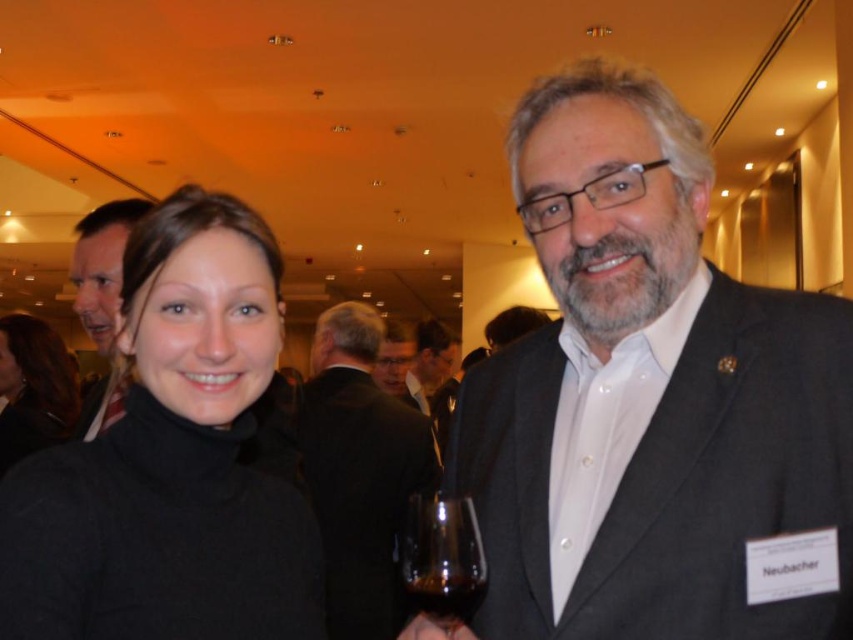
You are standing in the center of the hall and want to approach the dark gray suit at center. According to the coordinates, where should you walk to find it?

The dark gray suit at center is located at coordinates point (428,362), so you should walk towards the center area slightly to the right and forward to find it.

Looking at this image, you are a photographer adjusting your camera settings. You notice the black turtleneck sweater at center and the matte black glasses at center in your viewfinder. Which object should you focus on to ensure the other remains in the background?

You should focus on the black turtleneck sweater at center because it is closer to the viewer than the matte black glasses at center, so keeping it in focus will naturally place the matte black glasses at center in the background.